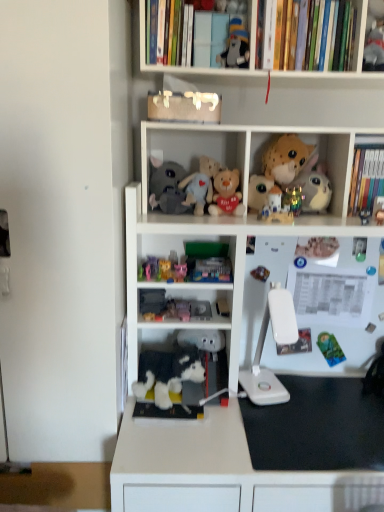
Question: In terms of size, does hardcover book at upper right, acting as the first book starting from the right, appear bigger or smaller than matte black plush at upper center, which ranks as the eleventh toy in bottom-to-top order?

Choices:
 (A) big
 (B) small

Answer: (A)

Question: From the image's perspective, is hardcover book at upper right, which is the 2th book from top to bottom, above or below matte black plush at upper center, arranged as the first toy when viewed from the top?

Choices:
 (A) below
 (B) above

Answer: (A)

Question: Based on their relative distances, which object is nearer to the white plastic lamp at lower right?

Choices:
 (A) shiny metallic ring at center, the ninth toy when ordered from top to bottom
 (B) metallic gold ornament at upper center, placed as the fifth toy when sorted from top to bottom
 (C) fluffy fabric stuffed animals at center, positioned as the 1th cabinet in left-to-right order
 (D) plush yellow bear at center, which ranks as the 7th toy in top-to-bottom order
 (E) fluffy gray plush at center, which ranks as the 9th toy in bottom-to-top order

Answer: (A)

Question: Which is farther from the hardcover books at upper right, the second book from the right?

Choices:
 (A) green plastic toy at lower right, the tenth toy viewed from the top
 (B) spotted plush toy at upper right, marked as the second toy in a top-to-bottom arrangement
 (C) white plastic bookcase at center
 (D) shiny metallic ring at center, the 3th toy positioned from the bottom
 (E) pink plush toy at center, the 8th toy in the top-to-bottom sequence

Answer: (A)